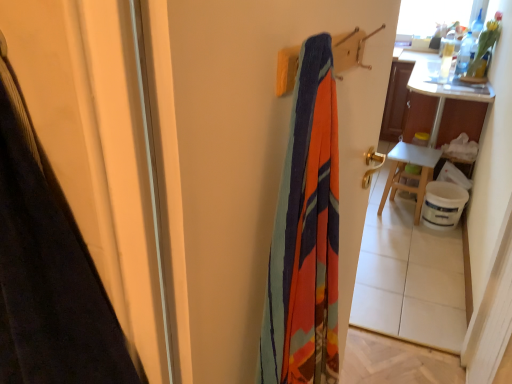
Image resolution: width=512 pixels, height=384 pixels. What are the coordinates of `free space in front of white wooden table at right` in the screenshot? It's located at (414, 236).